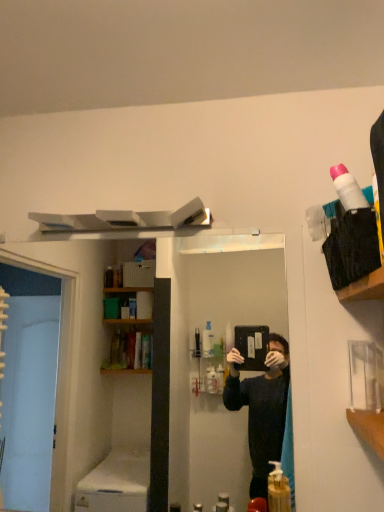
Question: Looking at their shapes, would you say white matte soap dispenser at lower center is wider or thinner than translucent yellow liquid at lower center?

Choices:
 (A) wide
 (B) thin

Answer: (B)

Question: Considering the positions of white matte soap dispenser at lower center and translucent yellow liquid at lower center in the image, is white matte soap dispenser at lower center bigger or smaller than translucent yellow liquid at lower center?

Choices:
 (A) small
 (B) big

Answer: (A)

Question: Considering the positions of white matte soap dispenser at lower center and translucent yellow liquid at lower center in the image, is white matte soap dispenser at lower center taller or shorter than translucent yellow liquid at lower center?

Choices:
 (A) short
 (B) tall

Answer: (A)

Question: Is translucent yellow liquid at lower center bigger or smaller than white matte soap dispenser at lower center?

Choices:
 (A) big
 (B) small

Answer: (A)

Question: Does point (271, 509) appear closer or farther from the camera than point (200, 502)?

Choices:
 (A) closer
 (B) farther

Answer: (A)

Question: From the image's perspective, is translucent yellow liquid at lower center positioned above or below white matte soap dispenser at lower center?

Choices:
 (A) above
 (B) below

Answer: (A)

Question: Is translucent yellow liquid at lower center spatially inside white matte soap dispenser at lower center, or outside of it?

Choices:
 (A) inside
 (B) outside

Answer: (B)